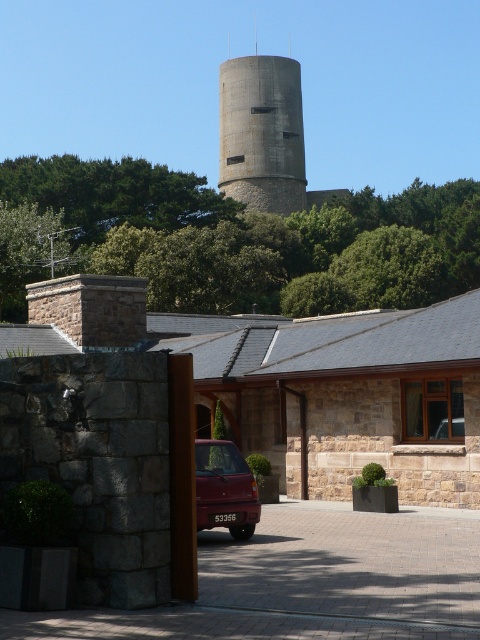
You are a delivery driver who needs to park your 2.5 meters tall truck near the shiny maroon sedan at center without blocking the view of the concrete water tower at center. Is this possible?

The concrete water tower at center is taller than the shiny maroon sedan at center. Since your truck is 2.5 meters tall, it is shorter than the concrete water tower, so you can park it near the shiny maroon sedan at center without blocking the view of the concrete water tower at center.

You are a delivery driver arriving at this location and need to park your truck. The truck is too tall to pass under the concrete water tower at center. Can you use the paved brick driveway at center to maneuver around the water tower?

The paved brick driveway at center is positioned under the concrete water tower at center, meaning the driveway runs directly beneath it. Since the truck cannot pass under the water tower, using the driveway would not allow maneuvering around it. You need to find an alternative route that bypasses both the driveway and the water tower.

You are a delivery driver who needs to park your truck next to the shiny maroon sedan at center without blocking the concrete water tower at center. Is there enough space between them?

The concrete water tower at center is bigger than the shiny maroon sedan at center, but since the water tower is a fixed structure, you can park your truck next to the sedan as long as you don